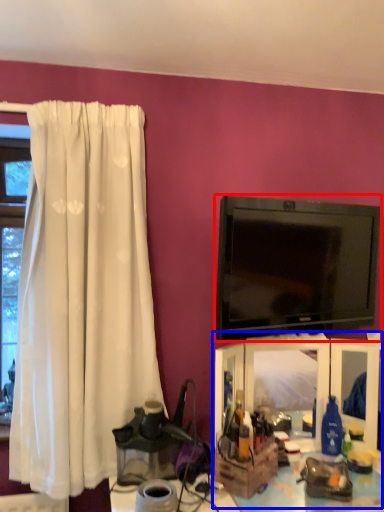
Question: Which of the following is the farthest to the observer, television (highlighted by a red box) or entertainment center (highlighted by a blue box)?

Choices:
 (A) television
 (B) entertainment center

Answer: (B)